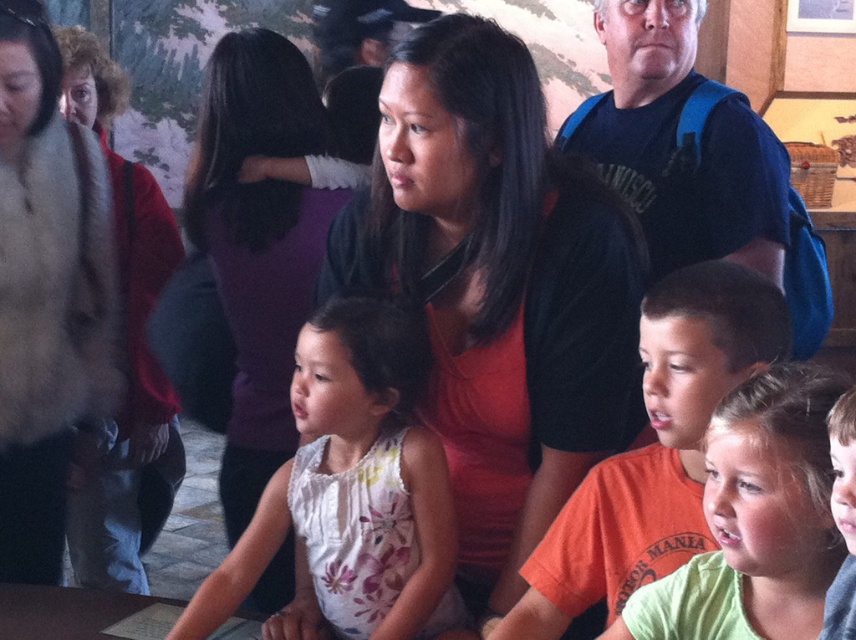
Question: Does matte black shirt at center have a greater width compared to matte brown fur coat at left?

Choices:
 (A) yes
 (B) no

Answer: (A)

Question: Can you confirm if matte brown fur coat at left is positioned above orange cotton shirt at center?

Choices:
 (A) yes
 (B) no

Answer: (A)

Question: Based on their relative distances, which object is nearer to the orange cotton shirt at center?

Choices:
 (A) matte brown fur coat at left
 (B) red sweater at left
 (C) blue fabric backpack at upper right

Answer: (C)

Question: Considering the real-world distances, which object is closest to the purple fabric at center?

Choices:
 (A) matte black shirt at center
 (B) green cotton shirt at center
 (C) white floral dress at center

Answer: (C)

Question: Is matte brown fur coat at left thinner than orange cotton shirt at center?

Choices:
 (A) no
 (B) yes

Answer: (B)

Question: Which point is farther to the camera?

Choices:
 (A) (265, 243)
 (B) (429, 376)

Answer: (A)